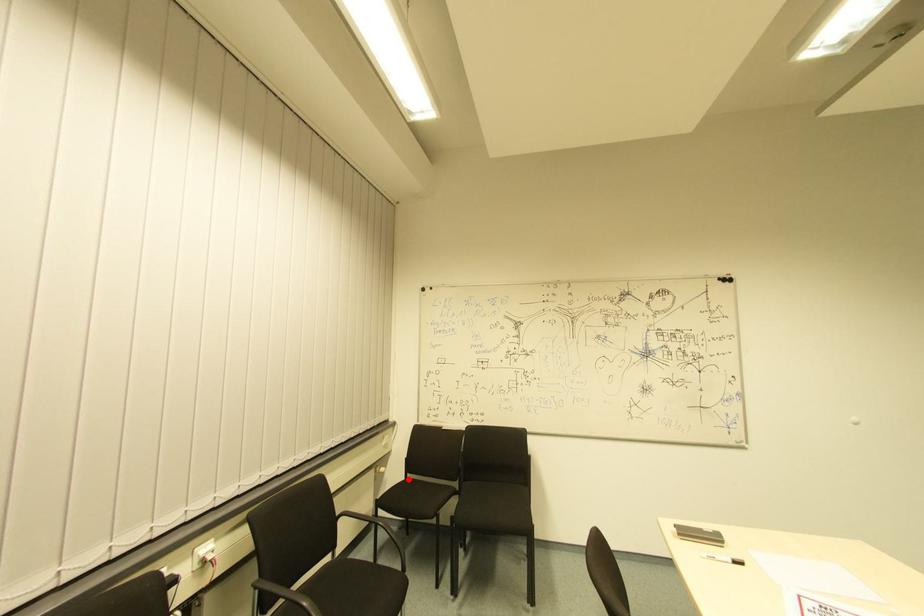
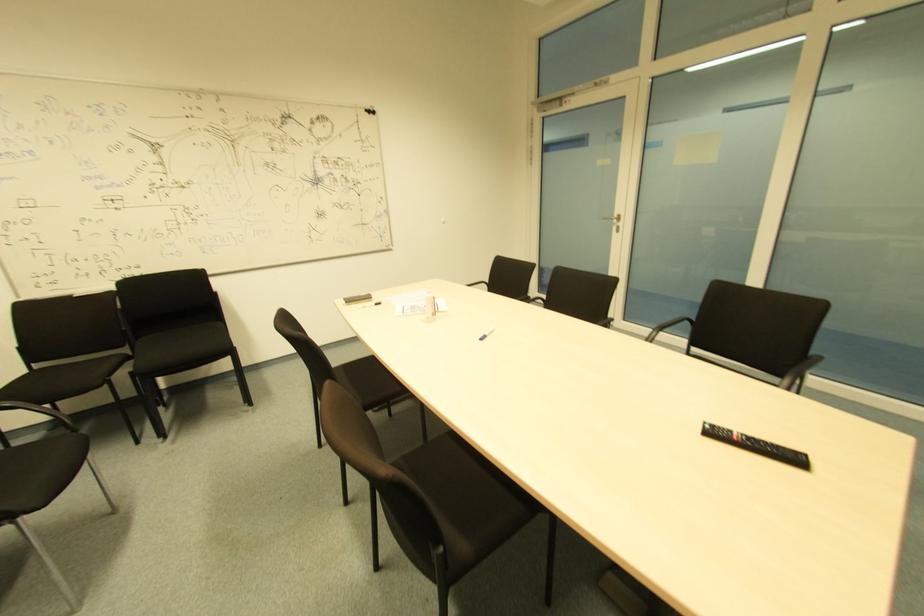
Where in the second image is the point corresponding to the highlighted location from the first image?

(34, 370)